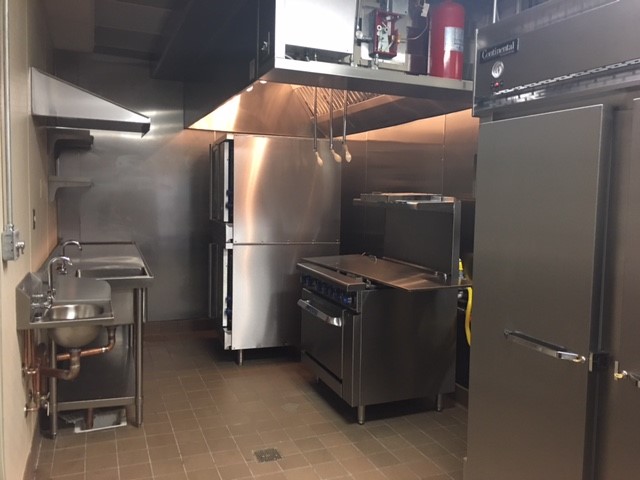
Identify the location of refrigerator. The image size is (640, 480). (561, 257).